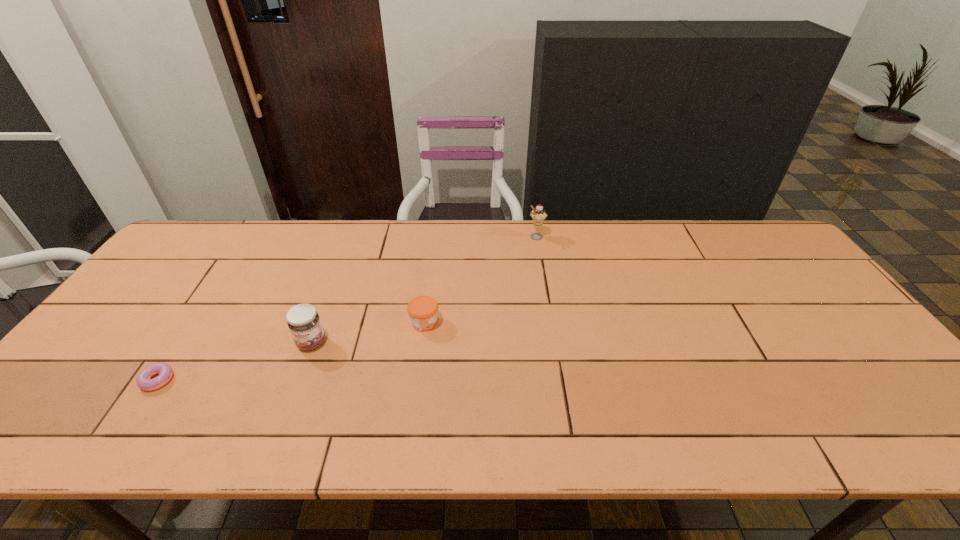
The image size is (960, 540). In order to click on vacant point located between the rightmost object and the leftmost object in this screenshot , I will do `click(347, 309)`.

Identify the location of unoccupied area between the shortest object and the tallest object. (347, 309).

You are a GUI agent. You are given a task and a screenshot of the screen. Output one action in this format:
    pyautogui.click(x=<x>, y=<y>)
    Task: Click on the free point between the shorter jam and the leftmost object
    This screenshot has height=540, width=960.
    Given the screenshot: What is the action you would take?
    pyautogui.click(x=291, y=352)

This screenshot has width=960, height=540. In order to click on vacant area that lies between the taller jam and the shortest object in this screenshot , I will do `click(234, 361)`.

This screenshot has width=960, height=540. I want to click on vacant area between the third tallest object and the tallest object, so coord(480,280).

This screenshot has width=960, height=540. Identify the location of free spot between the rightmost object and the right jam. (480, 280).

Image resolution: width=960 pixels, height=540 pixels. Find the location of `empty space between the doughnut and the third shortest object`. empty space between the doughnut and the third shortest object is located at coordinates (234, 361).

Where is `vacant area that lies between the third shortest object and the shortest object`? Image resolution: width=960 pixels, height=540 pixels. vacant area that lies between the third shortest object and the shortest object is located at coordinates (234, 361).

This screenshot has width=960, height=540. In order to click on object that stands as the third closest to the left jam in this screenshot , I will do `click(538, 215)`.

Select which object appears as the third closest to the left jam. Please provide its 2D coordinates. Your answer should be formatted as a tuple, i.e. [(x, y)], where the tuple contains the x and y coordinates of a point satisfying the conditions above.

[(538, 215)]